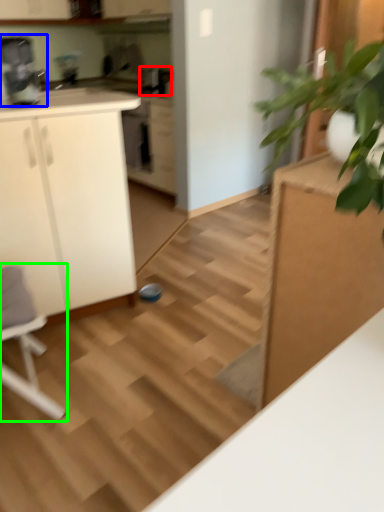
Question: Based on their relative distances, which object is farther from appliance (highlighted by a red box)? Choose from coffee machine (highlighted by a blue box) and rocking chair (highlighted by a green box).

Choices:
 (A) coffee machine
 (B) rocking chair

Answer: (B)